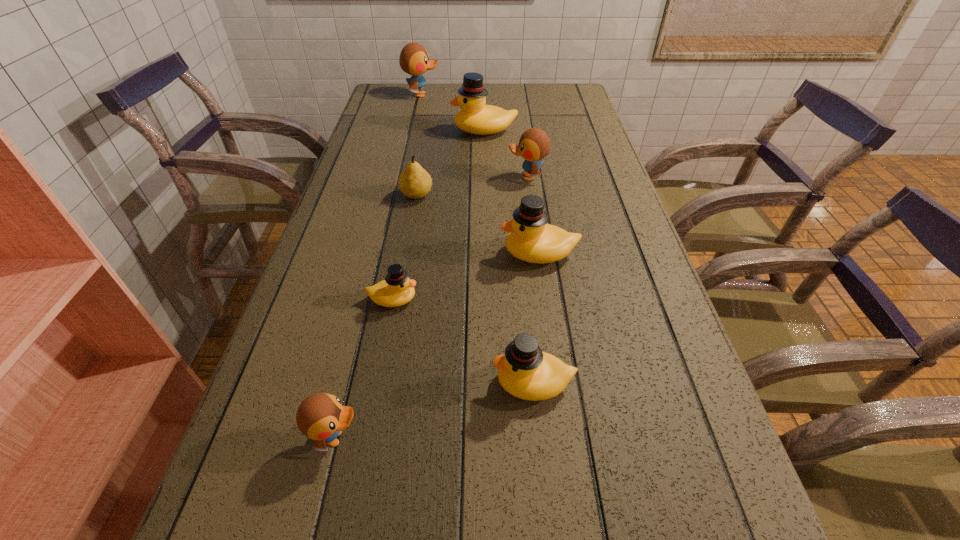
At what (x,y) coordinates should I click in order to perform the action: click on vacant space located on the front-facing side of the smallest yellow duck. Please return your answer as a coordinate pair (x, y). Looking at the image, I should click on (476, 299).

The height and width of the screenshot is (540, 960). In order to click on object situated at the far edge in this screenshot , I will do `click(414, 60)`.

Identify the location of object present at the right edge. (531, 239).

What are the coordinates of `object present at the far left corner` in the screenshot? It's located at [414, 60].

This screenshot has width=960, height=540. In order to click on free spot at the far edge of the desktop in this screenshot , I will do click(448, 99).

In the image, there is a desktop. Where is `vacant space at the left edge`? The height and width of the screenshot is (540, 960). vacant space at the left edge is located at coordinates (405, 129).

Locate an element on the screen. vacant space at the right edge is located at coordinates (617, 372).

The width and height of the screenshot is (960, 540). I want to click on free region at the far left corner of the desktop, so click(390, 103).

In the image, there is a desktop. Where is `vacant area at the far right corner`? vacant area at the far right corner is located at coordinates [588, 104].

I want to click on unoccupied area between the sixth farthest duck and the second farthest yellow duck, so click(x=537, y=318).